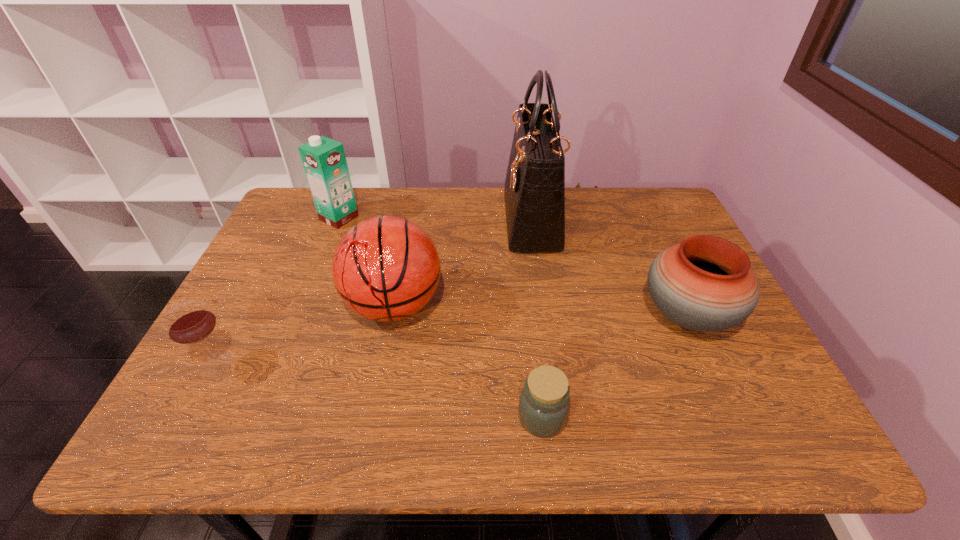
Identify the location of vacant space located 0.130m at the front of the handbag with visible charms. This screenshot has height=540, width=960. (464, 220).

Image resolution: width=960 pixels, height=540 pixels. What are the coordinates of `free point located at the front of the handbag with visible charms` in the screenshot? It's located at (442, 220).

Locate an element on the screen. vacant position located 0.190m on the front of the carton is located at coordinates (318, 271).

Identify the location of vacant space located on the side with spill of the third object from left to right. (383, 366).

This screenshot has height=540, width=960. What are the coordinates of `free region located 0.280m on the back of the fourth tallest object` in the screenshot? It's located at (643, 221).

You are a GUI agent. You are given a task and a screenshot of the screen. Output one action in this format:
    pyautogui.click(x=<x>, y=<y>)
    Task: Click on the blank area located 0.340m on the right of the wineglass
    The width and height of the screenshot is (960, 540).
    Given the screenshot: What is the action you would take?
    pyautogui.click(x=389, y=363)

Locate an element on the screen. free space located 0.120m on the right of the nearest object is located at coordinates (627, 417).

You are a GUI agent. You are given a task and a screenshot of the screen. Output one action in this format:
    pyautogui.click(x=<x>, y=<y>)
    Task: Click on the handbag that is at the far edge
    The height and width of the screenshot is (540, 960).
    Given the screenshot: What is the action you would take?
    pyautogui.click(x=534, y=190)

At what (x,y) coordinates should I click in order to perform the action: click on carton at the far edge. Please return your answer as a coordinate pair (x, y). The height and width of the screenshot is (540, 960). Looking at the image, I should click on (324, 160).

Where is `object positioned at the near edge`? object positioned at the near edge is located at coordinates (544, 405).